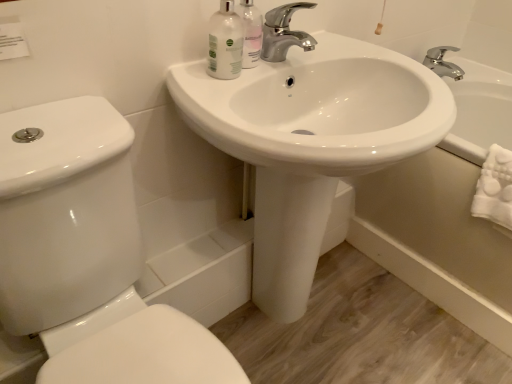
At what (x,y) coordinates should I click in order to perform the action: click on free location in front of white glossy bottle at upper center, acting as the 2th mouthwash starting from the right. Please return your answer as a coordinate pair (x, y). Image resolution: width=512 pixels, height=384 pixels. Looking at the image, I should click on (211, 82).